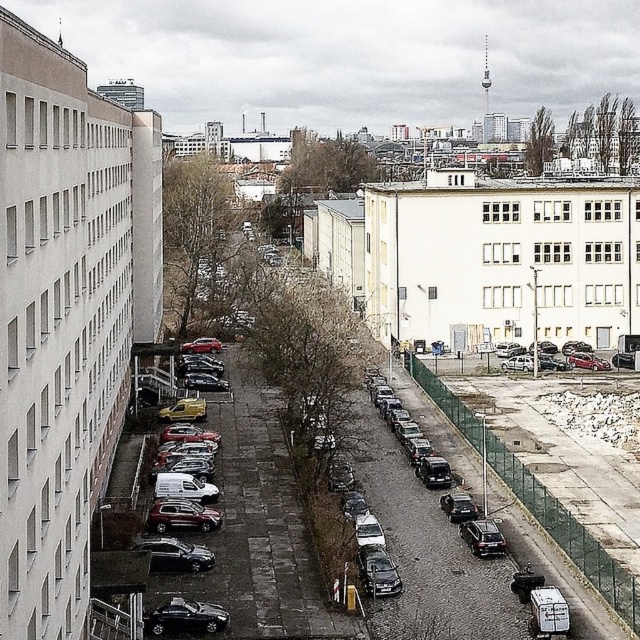
Question: Among these objects, which one is nearest to the camera?

Choices:
 (A) maroon metallic hatchback at lower left
 (B) shiny black car at lower center

Answer: (B)

Question: Which point appears closest to the camera in this image?

Choices:
 (A) (492, 522)
 (B) (161, 538)
 (C) (179, 522)

Answer: (B)

Question: Can you confirm if shiny black car at lower center is positioned below maroon metallic hatchback at lower left?

Choices:
 (A) no
 (B) yes

Answer: (B)

Question: Where is shiny black car at lower center located in relation to shiny black sedan at center-right in the image?

Choices:
 (A) left
 (B) right

Answer: (A)

Question: Does shiny black car at lower center appear on the right side of maroon metallic hatchback at lower left?

Choices:
 (A) no
 (B) yes

Answer: (B)

Question: Estimate the real-world distances between objects in this image. Which object is closer to the shiny black car at lower center?

Choices:
 (A) shiny silver sedan at center-left
 (B) maroon metallic hatchback at lower left

Answer: (A)